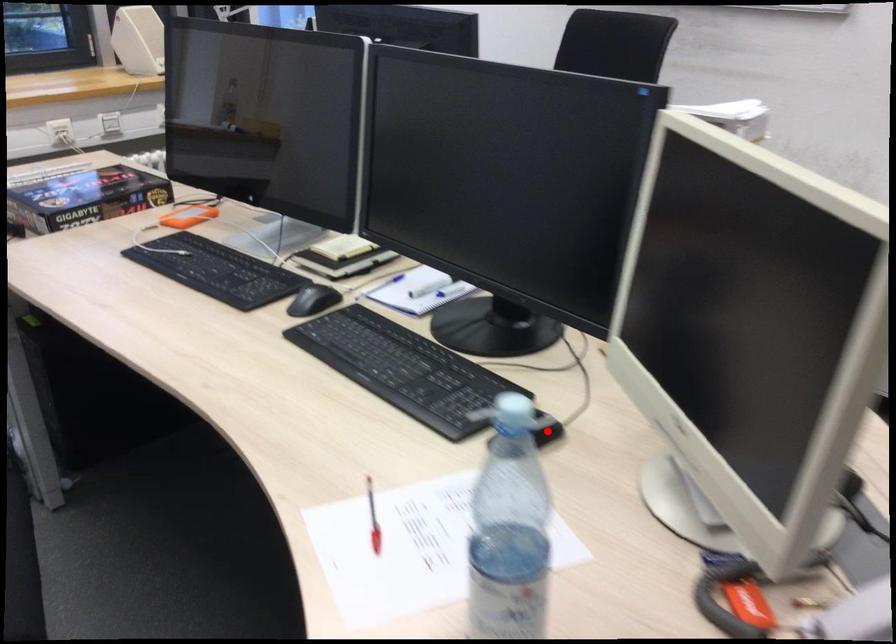
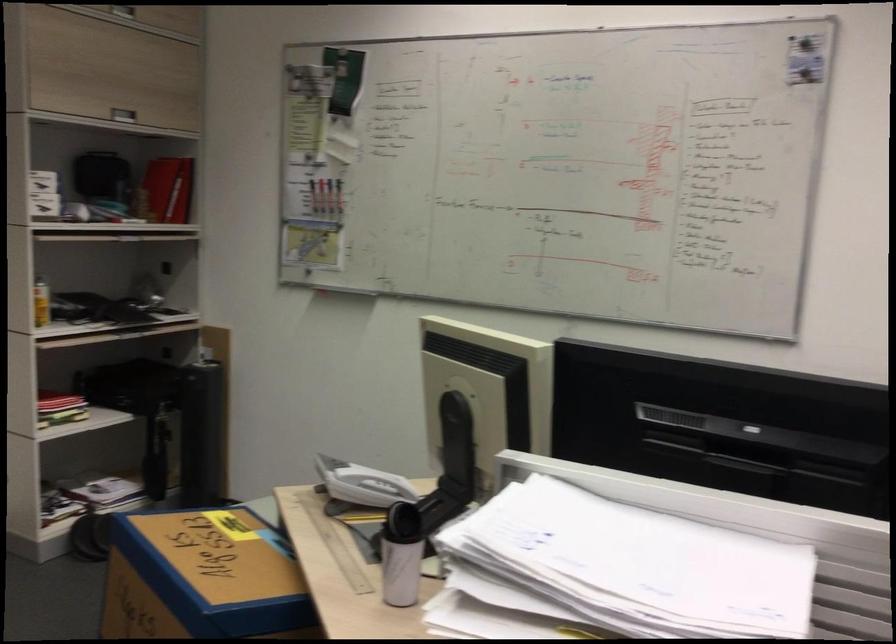
Question: I am providing you with two images of the same scene from different viewpoints. A red point is marked on the first image. Can you still see the location of the red point in image 2?

Choices:
 (A) Yes
 (B) No

Answer: (B)